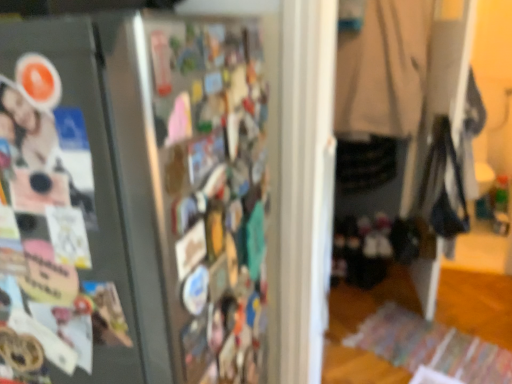
Question: Is satin black fridge at left wider or thinner than beige fabric coat at center?

Choices:
 (A) wide
 (B) thin

Answer: (A)

Question: Considering the positions of satin black fridge at left and beige fabric coat at center in the image, is satin black fridge at left taller or shorter than beige fabric coat at center?

Choices:
 (A) short
 (B) tall

Answer: (B)

Question: Considering the real-world distances, which object is closest to the satin black fridge at left?

Choices:
 (A) matte photo at left
 (B) beige fabric coat at center

Answer: (A)

Question: Which is nearer to the matte photo at left?

Choices:
 (A) beige fabric coat at center
 (B) satin black fridge at left

Answer: (B)